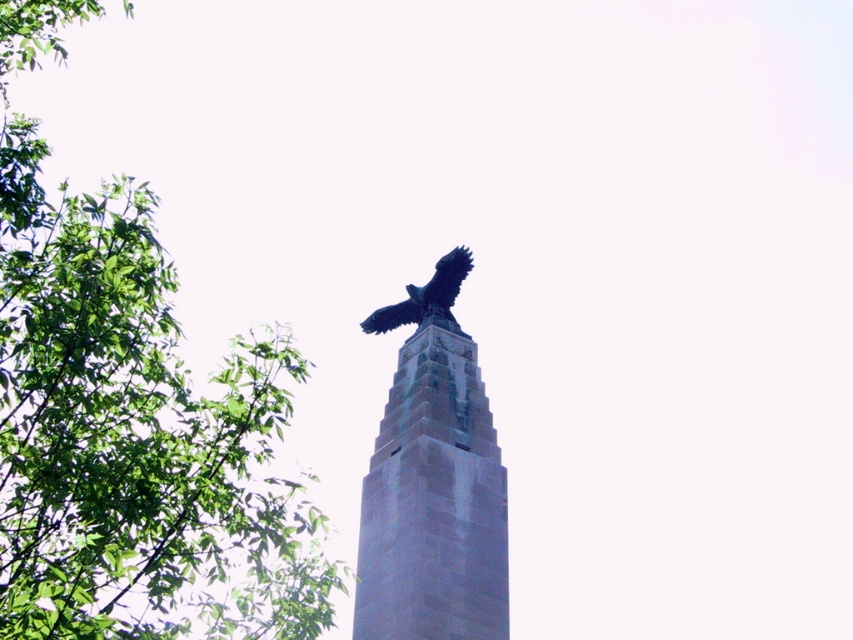
From the picture: Is the position of slate gray stone tower at upper center more distant than that of shiny black eagle at upper center?

No.

Is point (428, 408) farther from camera compared to point (460, 252)?

No, it is in front of (460, 252).

Which is behind, point (453, 566) or point (428, 291)?

The point (428, 291) is behind.

This screenshot has width=853, height=640. I want to click on slate gray stone tower at upper center, so click(x=433, y=500).

Looking at this image, does green leafy tree at upper left have a smaller size compared to shiny black eagle at upper center?

Incorrect, green leafy tree at upper left is not smaller in size than shiny black eagle at upper center.

Is point (10, 368) less distant than point (370, 323)?

Yes.

What do you see at coordinates (131, 419) in the screenshot? The width and height of the screenshot is (853, 640). I see `green leafy tree at upper left` at bounding box center [131, 419].

Find the location of `green leafy tree at upper left`. green leafy tree at upper left is located at coordinates (131, 419).

Which is in front, point (134, 228) or point (368, 529)?

Point (368, 529)

Does point (120, 243) lie behind point (376, 520)?

Yes, it is.

Where is `green leafy tree at upper left`? The width and height of the screenshot is (853, 640). green leafy tree at upper left is located at coordinates (131, 419).